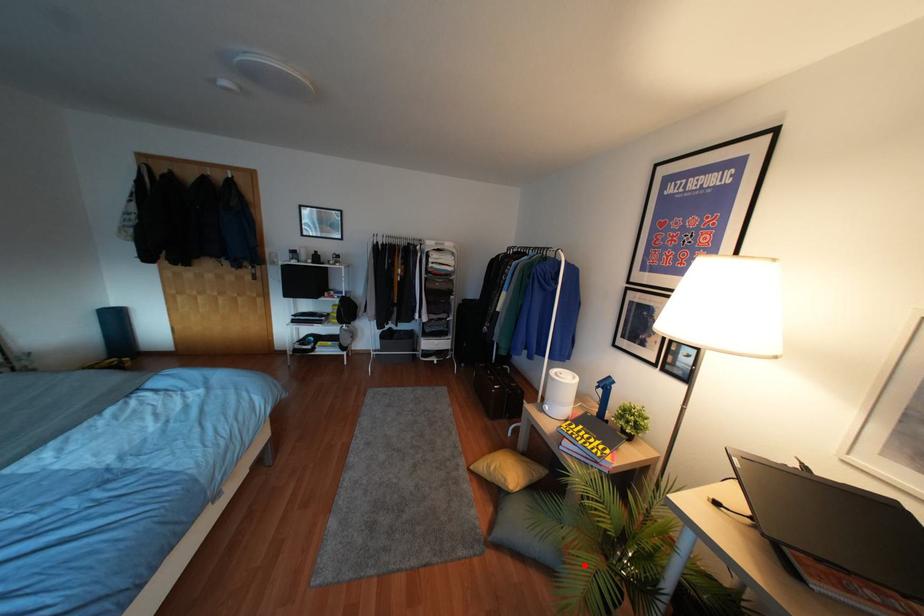
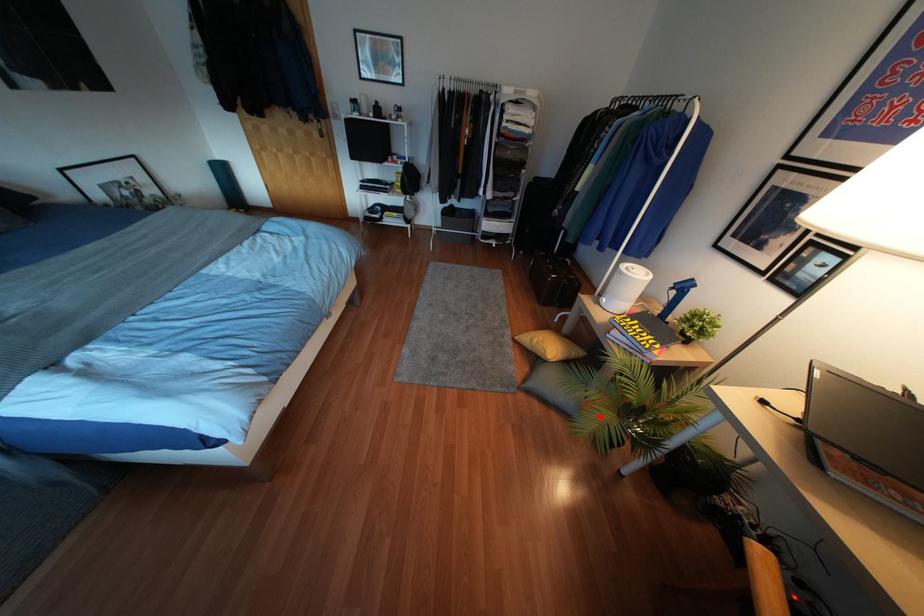
I am providing you with two images of the same scene from different viewpoints. A red point is marked on the first image and another point is marked on the second image. Does the point marked in image1 correspond to the same location as the one in image2?

Yes